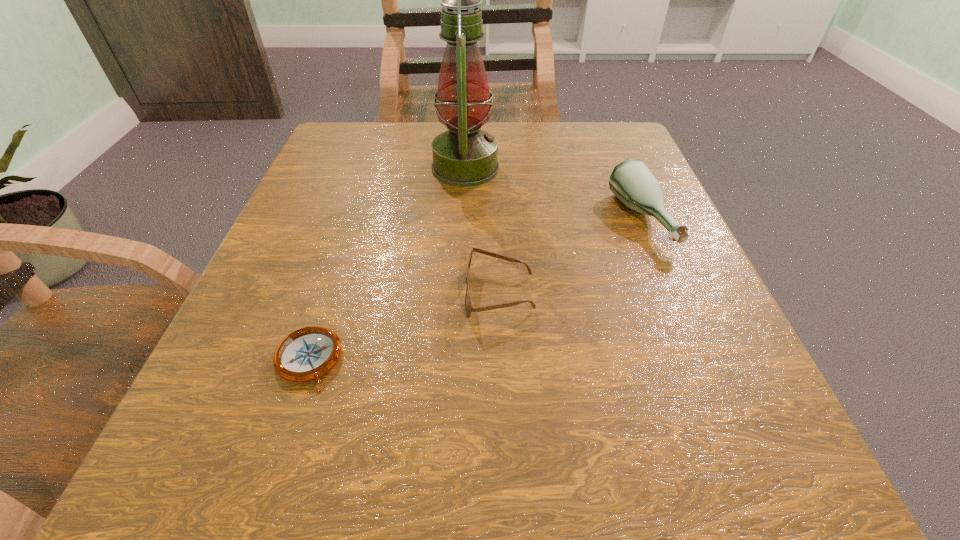
At what (x,y) coordinates should I click in order to perform the action: click on free space between the leftmost object and the tallest object. Please return your answer as a coordinate pair (x, y). This screenshot has height=540, width=960. Looking at the image, I should click on (387, 264).

Identify the location of empty location between the compass and the bottle. This screenshot has height=540, width=960. (474, 290).

Where is `unoccupied area between the third tallest object and the bottle`? This screenshot has height=540, width=960. unoccupied area between the third tallest object and the bottle is located at coordinates (569, 257).

The image size is (960, 540). What are the coordinates of `vacant space in between the oil lamp and the second nearest object` in the screenshot? It's located at (482, 231).

Locate an element on the screen. The image size is (960, 540). object that stands as the third closest to the tallest object is located at coordinates (306, 354).

Identify which object is located as the second nearest to the oil lamp. Please provide its 2D coordinates. Your answer should be formatted as a tuple, i.e. [(x, y)], where the tuple contains the x and y coordinates of a point satisfying the conditions above.

[(469, 308)]

You are a GUI agent. You are given a task and a screenshot of the screen. Output one action in this format:
    pyautogui.click(x=<x>, y=<y>)
    Task: Click on the vacant space that satisfies the following two spatial constraints: 1. on the frames of the third tallest object; 2. on the front side of the leftmost object
    
    Given the screenshot: What is the action you would take?
    pyautogui.click(x=502, y=360)

Identify the location of blank space that satisfies the following two spatial constraints: 1. on the front side of the rightmost object; 2. on the frames of the second nearest object. The width and height of the screenshot is (960, 540). (670, 294).